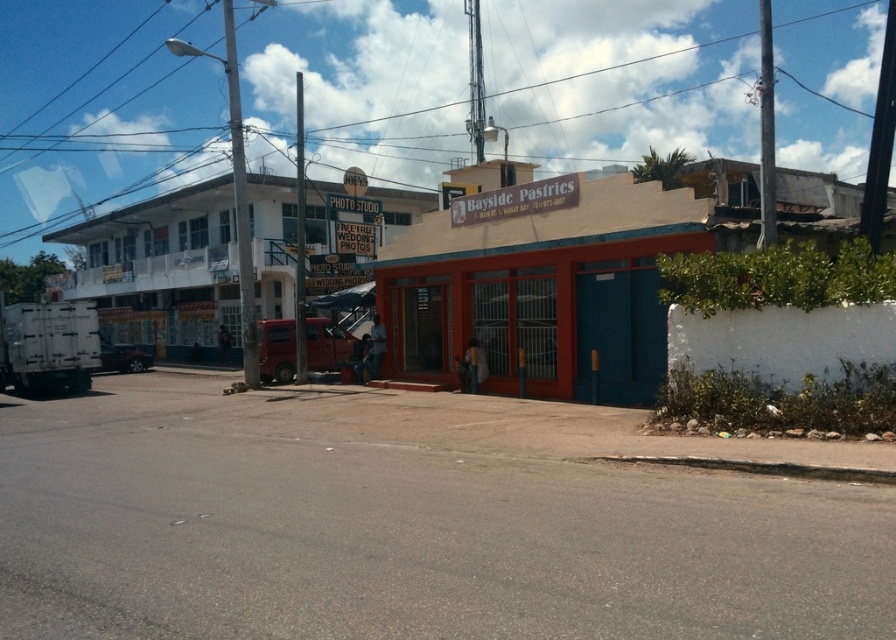
Question: Is white matte building at center behind matte orange storefront at center?

Choices:
 (A) no
 (B) yes

Answer: (B)

Question: Is white matte building at center below white matte building at upper left?

Choices:
 (A) no
 (B) yes

Answer: (A)

Question: From the image, what is the correct spatial relationship of white matte building at center in relation to white matte building at upper left?

Choices:
 (A) right
 (B) left

Answer: (A)

Question: Which point appears closest to the camera in this image?

Choices:
 (A) (647, 360)
 (B) (118, 289)
 (C) (885, 246)

Answer: (C)

Question: Based on their relative distances, which object is nearer to the white matte building at upper left?

Choices:
 (A) white matte building at center
 (B) matte orange storefront at center

Answer: (A)

Question: Which object appears farthest from the camera in this image?

Choices:
 (A) matte orange storefront at center
 (B) white matte building at upper left

Answer: (B)